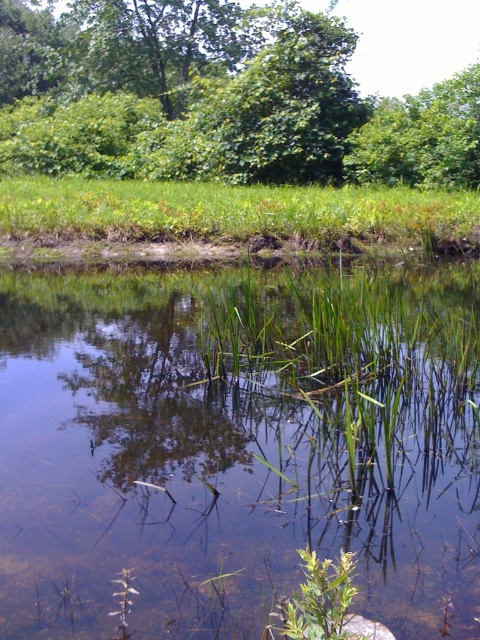
Question: From the image, what is the correct spatial relationship of green leafy tree at upper center in relation to green grass at center?

Choices:
 (A) above
 (B) below

Answer: (A)

Question: Which point appears farthest from the camera in this image?

Choices:
 (A) (216, 387)
 (B) (300, 180)

Answer: (B)

Question: Considering the relative positions of clear water at center and green leafy tree at upper center in the image provided, where is clear water at center located with respect to green leafy tree at upper center?

Choices:
 (A) below
 (B) above

Answer: (A)

Question: Which of the following is the farthest from the observer?

Choices:
 (A) (446, 384)
 (B) (38, 49)

Answer: (B)

Question: Which point is closer to the camera?

Choices:
 (A) (183, 228)
 (B) (228, 20)
 (C) (255, 572)

Answer: (C)

Question: Is green leafy tree at upper center positioned at the back of green grass at center?

Choices:
 (A) yes
 (B) no

Answer: (A)